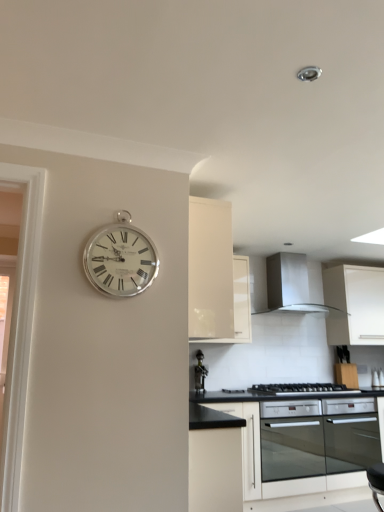
Question: Would you consider silver metallic clock at upper left to be distant from black matte gas stove at lower center?

Choices:
 (A) yes
 (B) no

Answer: (A)

Question: Is silver metallic clock at upper left smaller than black matte gas stove at lower center?

Choices:
 (A) no
 (B) yes

Answer: (B)

Question: Is silver metallic clock at upper left closer to camera compared to black matte gas stove at lower center?

Choices:
 (A) yes
 (B) no

Answer: (A)

Question: From the image's perspective, is silver metallic clock at upper left beneath black matte gas stove at lower center?

Choices:
 (A) no
 (B) yes

Answer: (A)

Question: Is silver metallic clock at upper left positioned beyond the bounds of black matte gas stove at lower center?

Choices:
 (A) yes
 (B) no

Answer: (A)

Question: Considering the positions of point (120, 220) and point (324, 386), is point (120, 220) closer or farther from the camera than point (324, 386)?

Choices:
 (A) closer
 (B) farther

Answer: (A)

Question: Based on their sizes in the image, would you say silver metallic clock at upper left is bigger or smaller than black matte gas stove at lower center?

Choices:
 (A) big
 (B) small

Answer: (B)

Question: In the image, is silver metallic clock at upper left positioned in front of or behind black matte gas stove at lower center?

Choices:
 (A) behind
 (B) front

Answer: (B)

Question: Considering the positions of silver metallic clock at upper left and black matte gas stove at lower center in the image, is silver metallic clock at upper left taller or shorter than black matte gas stove at lower center?

Choices:
 (A) short
 (B) tall

Answer: (B)

Question: Is point (319, 310) closer or farther from the camera than point (198, 366)?

Choices:
 (A) closer
 (B) farther

Answer: (B)

Question: Is satin silver exhaust hood at upper center in front of or behind metallic wine rack at center in the image?

Choices:
 (A) behind
 (B) front

Answer: (A)

Question: From the image's perspective, is satin silver exhaust hood at upper center located above or below metallic wine rack at center?

Choices:
 (A) above
 (B) below

Answer: (A)

Question: In the image, is satin silver exhaust hood at upper center on the left side or the right side of metallic wine rack at center?

Choices:
 (A) left
 (B) right

Answer: (B)

Question: Is metallic wine rack at center in front of or behind black glass oven at lower center in the image?

Choices:
 (A) behind
 (B) front

Answer: (A)

Question: From a real-world perspective, is metallic wine rack at center positioned above or below black glass oven at lower center?

Choices:
 (A) below
 (B) above

Answer: (B)